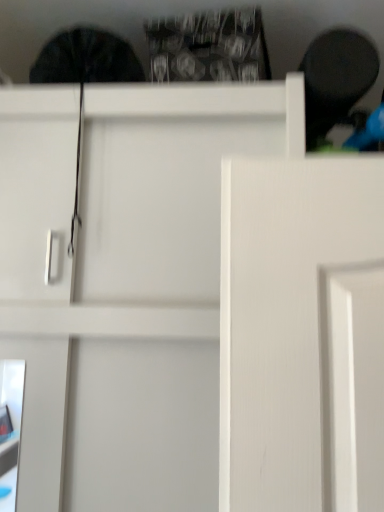
Find the location of a particular element. black matte swivel chair at upper right is located at coordinates (337, 80).

What do you see at coordinates (337, 80) in the screenshot?
I see `black matte swivel chair at upper right` at bounding box center [337, 80].

Identify the location of black matte swivel chair at upper right. (337, 80).